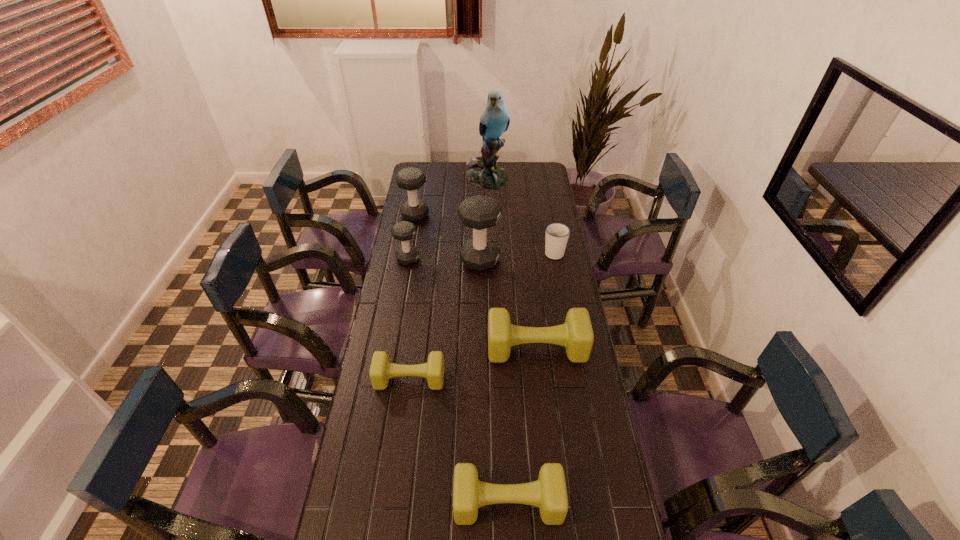
Identify the location of the farthest object. This screenshot has height=540, width=960. (483, 171).

Image resolution: width=960 pixels, height=540 pixels. I want to click on the tallest object, so click(483, 171).

At what (x,y) coordinates should I click in order to perform the action: click on the biggest gray dumbbell. Please return your answer as a coordinate pair (x, y). This screenshot has width=960, height=540. Looking at the image, I should click on (479, 212).

Where is `the rightmost gray dumbbell`? the rightmost gray dumbbell is located at coordinates (479, 212).

You are a GUI agent. You are given a task and a screenshot of the screen. Output one action in this format:
    pyautogui.click(x=<x>, y=<y>)
    Task: Click on the second biggest gray dumbbell
    This screenshot has width=960, height=540.
    Given the screenshot: What is the action you would take?
    pyautogui.click(x=410, y=179)

Locate an element on the screen. This screenshot has width=960, height=540. the seventh nearest object is located at coordinates (410, 179).

This screenshot has width=960, height=540. I want to click on the smallest gray dumbbell, so click(x=404, y=231).

This screenshot has height=540, width=960. What are the coordinates of `the fourth tallest dumbbell` in the screenshot? It's located at (576, 335).

Image resolution: width=960 pixels, height=540 pixels. What are the coordinates of `the farthest olive dumbbell` in the screenshot? It's located at (576, 335).

Identify the location of white cup. The height and width of the screenshot is (540, 960). (557, 234).